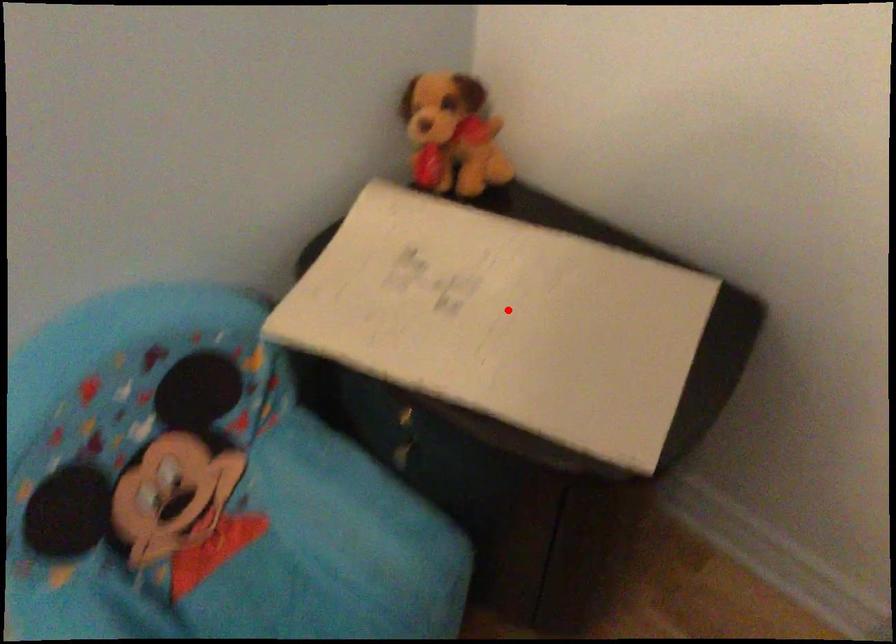
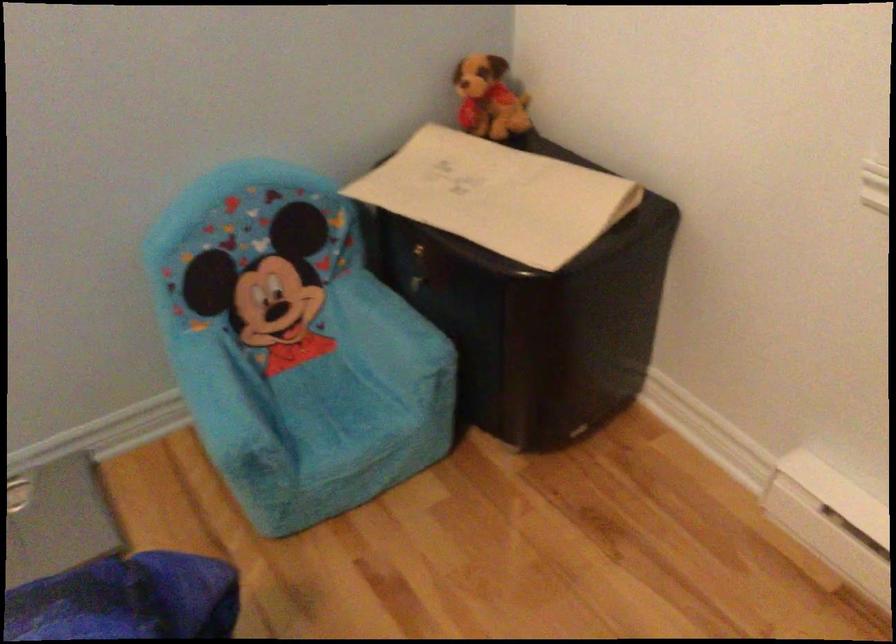
In the second image, find the point that corresponds to the highlighted location in the first image.

(497, 196)